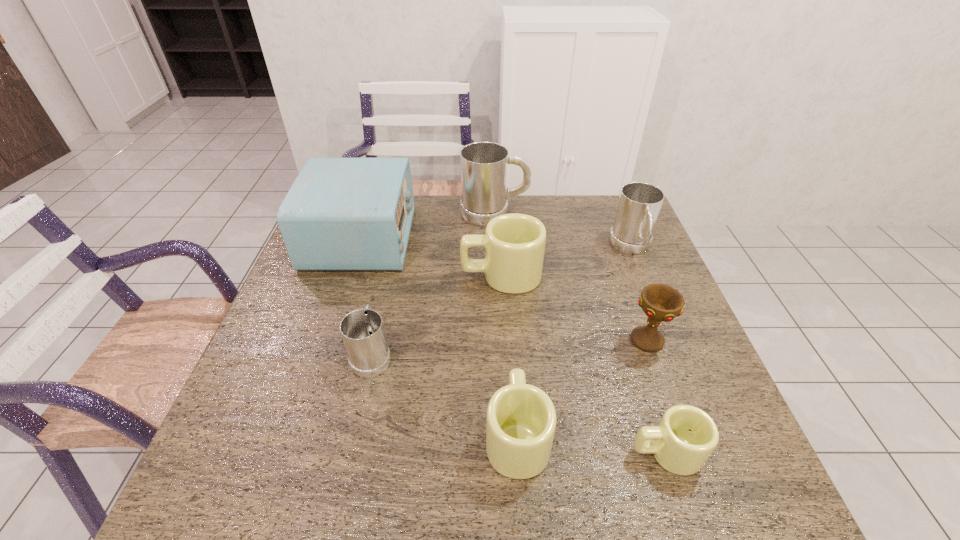
Find the location of a particular element. The image size is (960, 540). chalice present at the right edge is located at coordinates (661, 303).

I want to click on object that is at the far left corner, so click(x=340, y=213).

Identify the location of object present at the far right corner. The image size is (960, 540). (639, 205).

The width and height of the screenshot is (960, 540). I want to click on object present at the near right corner, so click(686, 436).

You are a GUI agent. You are given a task and a screenshot of the screen. Output one action in this format:
    pyautogui.click(x=<x>, y=<y>)
    Task: Click on the vacant space at the far edge
    This screenshot has width=960, height=540.
    Given the screenshot: What is the action you would take?
    (443, 211)

In the image, there is a desktop. Identify the location of free space at the near edge. (483, 480).

This screenshot has height=540, width=960. In the image, there is a desktop. What are the coordinates of `free region at the left edge` in the screenshot? It's located at (340, 294).

This screenshot has height=540, width=960. I want to click on blank space at the right edge of the desktop, so click(606, 241).

The width and height of the screenshot is (960, 540). I want to click on vacant region at the near right corner of the desktop, so click(x=732, y=493).

The width and height of the screenshot is (960, 540). I want to click on free spot between the red chalice and the farthest beige mug, so click(x=574, y=308).